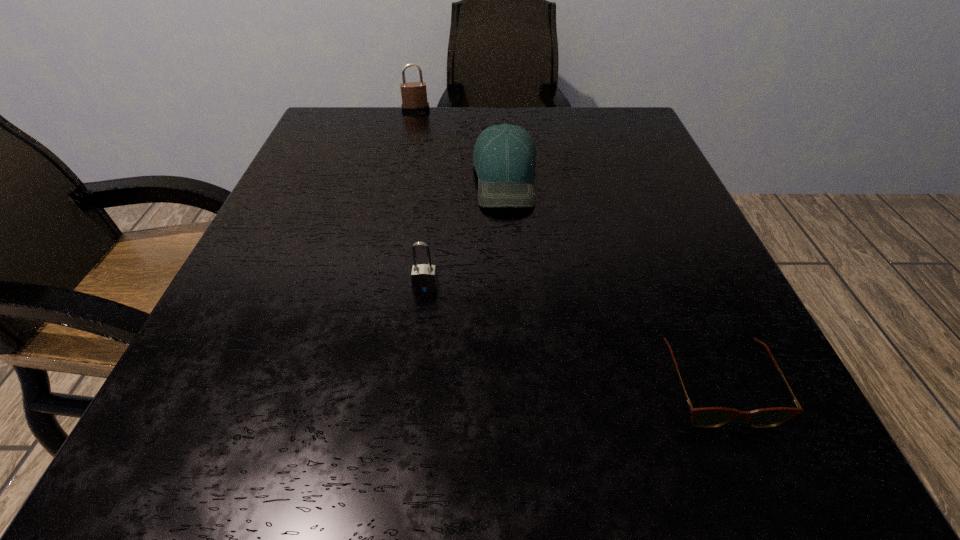
Where is `vacant area that lies between the baseball cap and the rightmost object`? vacant area that lies between the baseball cap and the rightmost object is located at coordinates [611, 282].

Where is `empty space between the shortest object and the second object from left to right`? The width and height of the screenshot is (960, 540). empty space between the shortest object and the second object from left to right is located at coordinates click(571, 336).

Identify the location of the closest object to the nearer padlock. The height and width of the screenshot is (540, 960). (504, 157).

Choose which object is the second nearest neighbor to the second object from left to right. Please provide its 2D coordinates. Your answer should be formatted as a tuple, i.e. [(x, y)], where the tuple contains the x and y coordinates of a point satisfying the conditions above.

[(708, 417)]